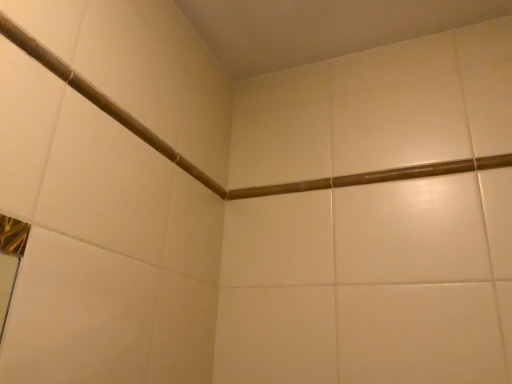
Describe the element at coordinates (377, 176) in the screenshot. Image resolution: width=512 pixels, height=384 pixels. I see `brown matte beam at center` at that location.

You are a GUI agent. You are given a task and a screenshot of the screen. Output one action in this format:
    pyautogui.click(x=<x>, y=<y>)
    Task: Click on the brown matte beam at center
    
    Given the screenshot: What is the action you would take?
    pyautogui.click(x=377, y=176)

This screenshot has width=512, height=384. What are the coordinates of `brown matte beam at center` in the screenshot? It's located at (377, 176).